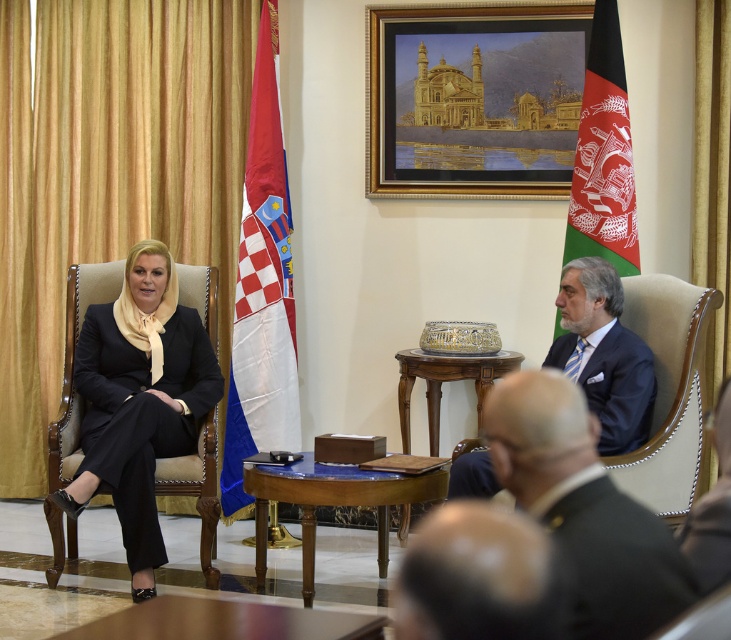
Question: Can you confirm if dark blue suit at center is positioned above mahogany wood table at center?

Choices:
 (A) yes
 (B) no

Answer: (A)

Question: Is black satin suit at left bigger than satin blue chair at right?

Choices:
 (A) yes
 (B) no

Answer: (A)

Question: Observing the image, what is the correct spatial positioning of gold-framed painting at upper center in reference to white fabric flag at center?

Choices:
 (A) below
 (B) above

Answer: (B)

Question: Estimate the real-world distances between objects in this image. Which object is closer to the woodenobject at center?

Choices:
 (A) white fabric flag at center
 (B) wooden polished table at center
 (C) mahogany wood table at center
 (D) dark blue suit at center

Answer: (A)

Question: Which of the following is the farthest from the observer?

Choices:
 (A) wooden polished table at center
 (B) dark blue suit at center
 (C) mahogany wood table at center
 (D) satin blue chair at right

Answer: (C)

Question: Which point is farther to the camera?

Choices:
 (A) wooden polished table at center
 (B) satin blue chair at right
 (C) woodenobject at center

Answer: (C)